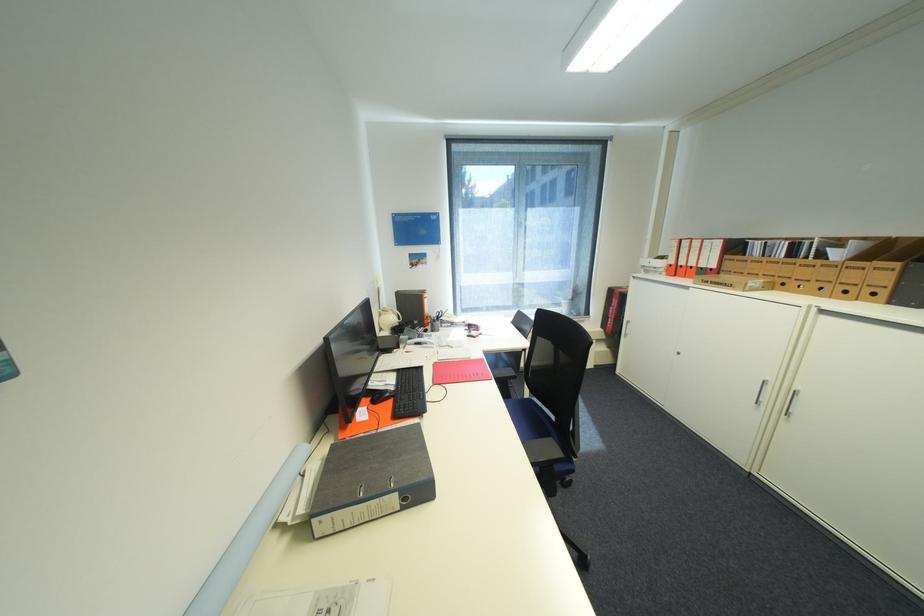
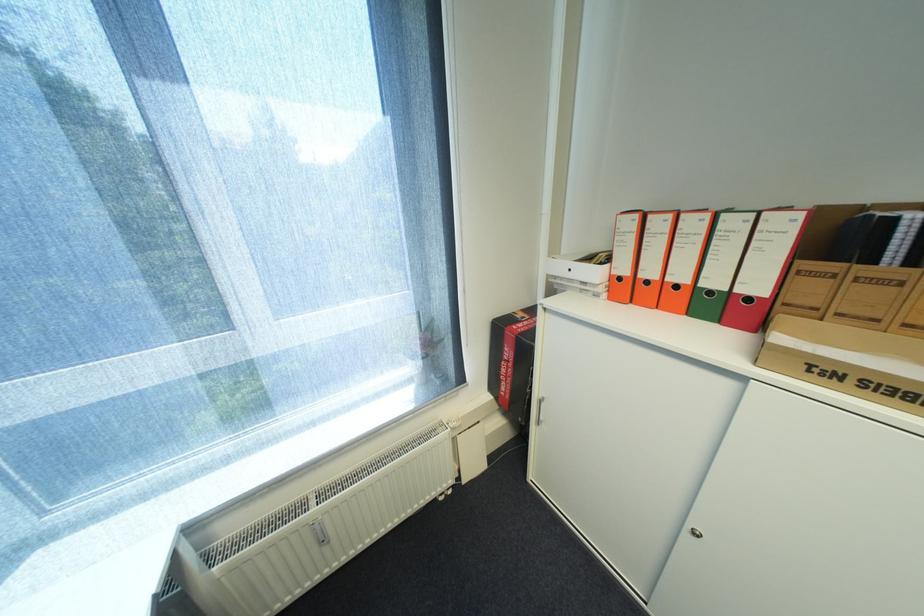
Find the pixel in the second image that matches (678,265) in the first image.

(627, 278)